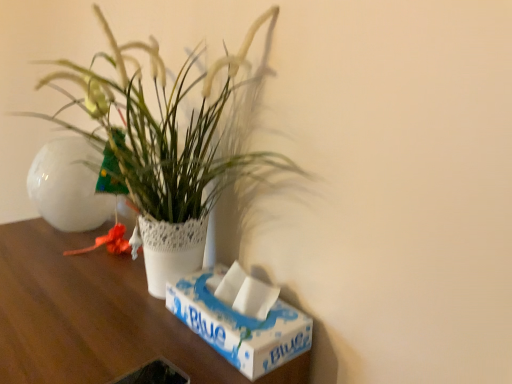
Question: Considering the relative sizes of white lace pot at center and wooden table at center in the image provided, is white lace pot at center wider than wooden table at center?

Choices:
 (A) yes
 (B) no

Answer: (B)

Question: Is white lace pot at center with wooden table at center?

Choices:
 (A) yes
 (B) no

Answer: (B)

Question: Is white lace pot at center shorter than wooden table at center?

Choices:
 (A) yes
 (B) no

Answer: (A)

Question: From a real-world perspective, is white lace pot at center on wooden table at center?

Choices:
 (A) no
 (B) yes

Answer: (B)

Question: Can you confirm if white lace pot at center is smaller than wooden table at center?

Choices:
 (A) yes
 (B) no

Answer: (A)

Question: Is white cardboard box at lower right bigger or smaller than white lace pot at center?

Choices:
 (A) big
 (B) small

Answer: (B)

Question: Considering the positions of white cardboard box at lower right and white lace pot at center in the image, is white cardboard box at lower right wider or thinner than white lace pot at center?

Choices:
 (A) wide
 (B) thin

Answer: (B)

Question: Considering the relative positions of white cardboard box at lower right and white lace pot at center in the image provided, is white cardboard box at lower right to the left or to the right of white lace pot at center?

Choices:
 (A) right
 (B) left

Answer: (A)

Question: Does point (308, 337) appear closer or farther from the camera than point (203, 173)?

Choices:
 (A) farther
 (B) closer

Answer: (B)

Question: From the image's perspective, is wooden table at center above or below white cardboard box at lower right?

Choices:
 (A) below
 (B) above

Answer: (A)

Question: Is wooden table at center in front of or behind white cardboard box at lower right in the image?

Choices:
 (A) behind
 (B) front

Answer: (B)

Question: Is wooden table at center bigger or smaller than white cardboard box at lower right?

Choices:
 (A) big
 (B) small

Answer: (A)

Question: In terms of width, does wooden table at center look wider or thinner when compared to white cardboard box at lower right?

Choices:
 (A) wide
 (B) thin

Answer: (A)

Question: Based on their positions, is white lace pot at center located to the left or right of wooden table at center?

Choices:
 (A) right
 (B) left

Answer: (A)

Question: In the image, is white lace pot at center positioned in front of or behind wooden table at center?

Choices:
 (A) front
 (B) behind

Answer: (B)